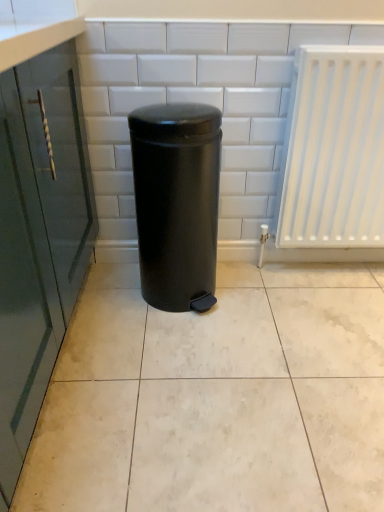
Question: Is black matte waste container at center next to white glossy ceramic tile at center and touching it?

Choices:
 (A) no
 (B) yes

Answer: (A)

Question: From a real-world perspective, is black matte waste container at center below white glossy ceramic tile at center?

Choices:
 (A) no
 (B) yes

Answer: (A)

Question: From the image's perspective, does black matte waste container at center appear lower than white glossy ceramic tile at center?

Choices:
 (A) no
 (B) yes

Answer: (A)

Question: Is black matte waste container at center looking in the opposite direction of white glossy ceramic tile at center?

Choices:
 (A) yes
 (B) no

Answer: (B)

Question: Does black matte waste container at center lie behind white glossy ceramic tile at center?

Choices:
 (A) yes
 (B) no

Answer: (A)

Question: Is black matte waste container at center taller than white glossy ceramic tile at center?

Choices:
 (A) yes
 (B) no

Answer: (A)

Question: Can you confirm if black matte waste container at center is thinner than white plastic radiator at right?

Choices:
 (A) no
 (B) yes

Answer: (A)

Question: Is black matte waste container at center shorter than white plastic radiator at right?

Choices:
 (A) yes
 (B) no

Answer: (A)

Question: Is black matte waste container at center with white plastic radiator at right?

Choices:
 (A) yes
 (B) no

Answer: (B)

Question: From a real-world perspective, is black matte waste container at center over white plastic radiator at right?

Choices:
 (A) no
 (B) yes

Answer: (A)

Question: Considering the relative positions of black matte waste container at center and white plastic radiator at right in the image provided, is black matte waste container at center behind white plastic radiator at right?

Choices:
 (A) no
 (B) yes

Answer: (A)

Question: Is black matte waste container at center looking in the opposite direction of white plastic radiator at right?

Choices:
 (A) yes
 (B) no

Answer: (B)

Question: From the image's perspective, is white glossy ceramic tile at center on top of white plastic radiator at right?

Choices:
 (A) yes
 (B) no

Answer: (B)